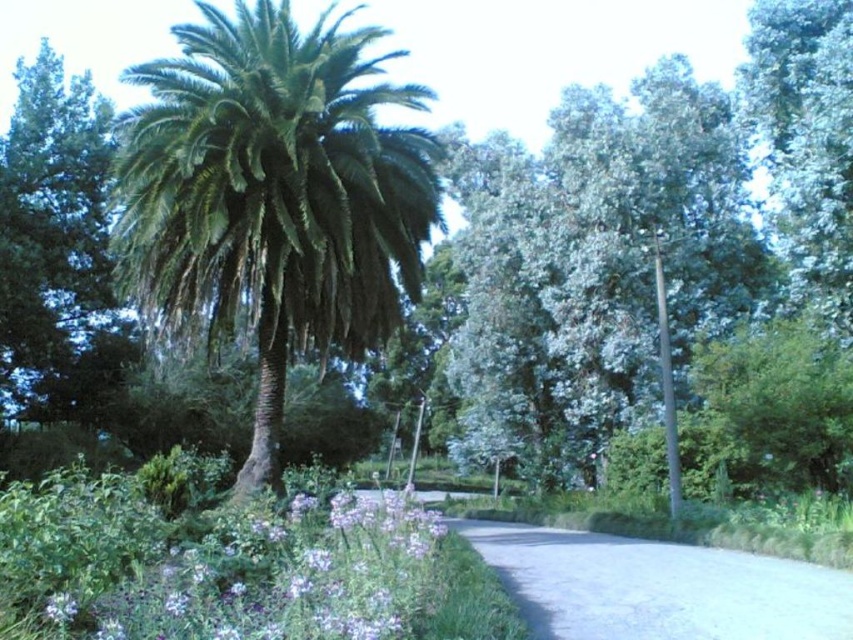
Question: Which is farther from the gray concrete driveway at center?

Choices:
 (A) green leafy palm at center
 (B) purple soft-textured flowers at lower left

Answer: (A)

Question: Does purple soft-textured flowers at lower left appear over gray concrete driveway at center?

Choices:
 (A) no
 (B) yes

Answer: (B)

Question: Among these objects, which one is farthest from the camera?

Choices:
 (A) purple soft-textured flowers at lower left
 (B) green leafy palm at center

Answer: (B)

Question: Can you confirm if purple soft-textured flowers at lower left is thinner than gray concrete driveway at center?

Choices:
 (A) yes
 (B) no

Answer: (B)

Question: Considering the real-world distances, which object is closest to the purple soft-textured flowers at lower left?

Choices:
 (A) green leafy palm at center
 (B) gray concrete driveway at center

Answer: (B)

Question: Can you confirm if green leafy palm at center is positioned above purple soft-textured flowers at lower left?

Choices:
 (A) no
 (B) yes

Answer: (B)